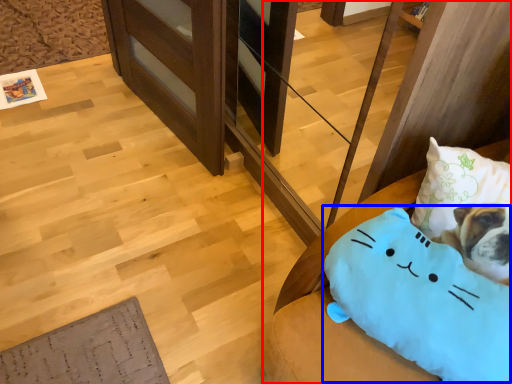
Question: Which object appears farthest to the camera in this image, furniture (highlighted by a red box) or pillow (highlighted by a blue box)?

Choices:
 (A) furniture
 (B) pillow

Answer: (A)